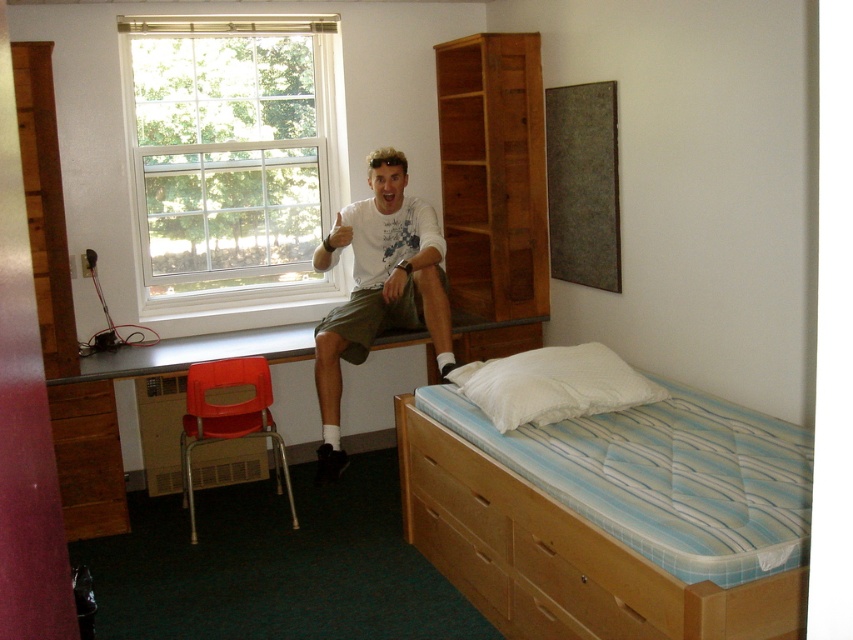
You are trying to determine which object is taller between the light blue striped mattress at lower right and the white wood window at upper left. Based on the scene description, which one is taller?

The light blue striped mattress at lower right is taller than the white wood window at upper left according to the description.

You are moving into this bedroom and need to determine which item takes up more space in the room. Based on the scene, which one is larger between the light blue striped mattress at lower right and the white wood window at upper left?

The light blue striped mattress at lower right is bigger than the white wood window at upper left, so it takes up more space in the room.